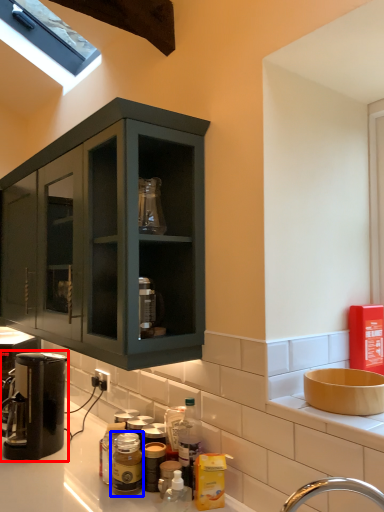
Question: Which object is further to the camera taking this photo, coffee machine (highlighted by a red box) or bottle (highlighted by a blue box)?

Choices:
 (A) coffee machine
 (B) bottle

Answer: (A)